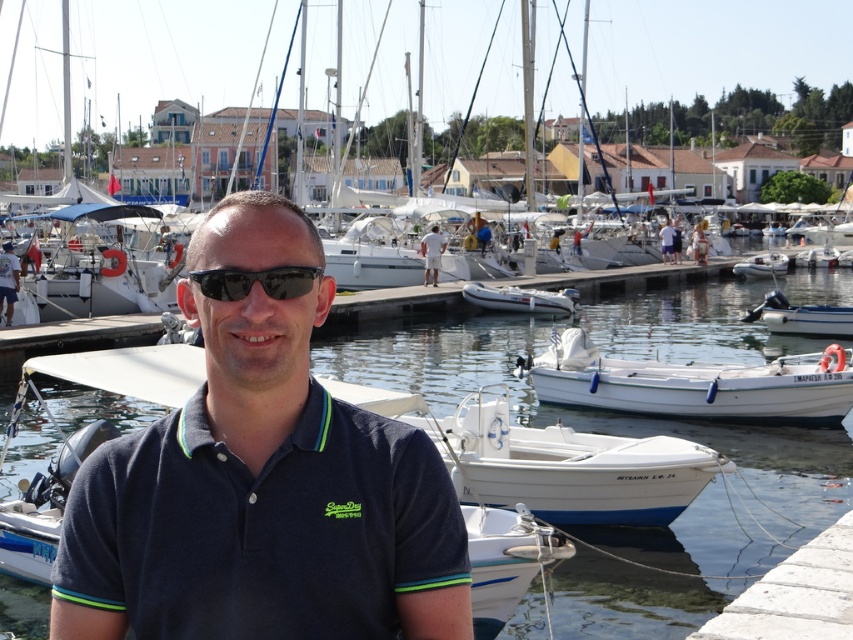
You are a photographer trying to capture the reflection of the white matte boat at lower center in the clear water at center. Based on the scene description, can you confirm if the reflection will be fully visible in the water?

The clear water at center is taller than white matte boat at lower center, so the reflection of the white matte boat at lower center will be fully visible in the clear water at center because the water has sufficient height to accommodate the boat.

You are a photographer standing at the edge of the marina pier. You want to take a photo of the black plastic sunglasses at center and the white rubber dinghy at center. The camera you are using has a maximum focus range of 100 feet. Will you be able to capture both objects clearly in the same photo?

The black plastic sunglasses at center is 123.30 feet from the white rubber dinghy at center. Since the distance between them exceeds the camera maximum focus range of 100 feet, you will not be able to capture both objects clearly in the same photo.

Based on the photo, you are standing at the edge of the marina and see the point marked at coordinates (9,458). If you want to throw a small object to that point, will it land within 25 meters from you?

The point at coordinates (9,458) is 22.49 meters away from the viewer. Since 22.49 meters is less than 25 meters, the object will land within 25 meters from you.